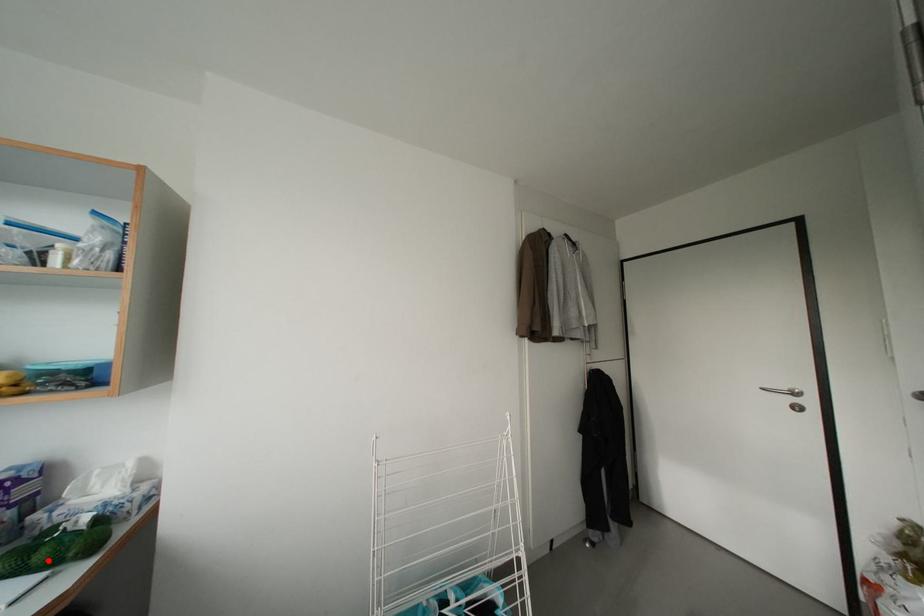
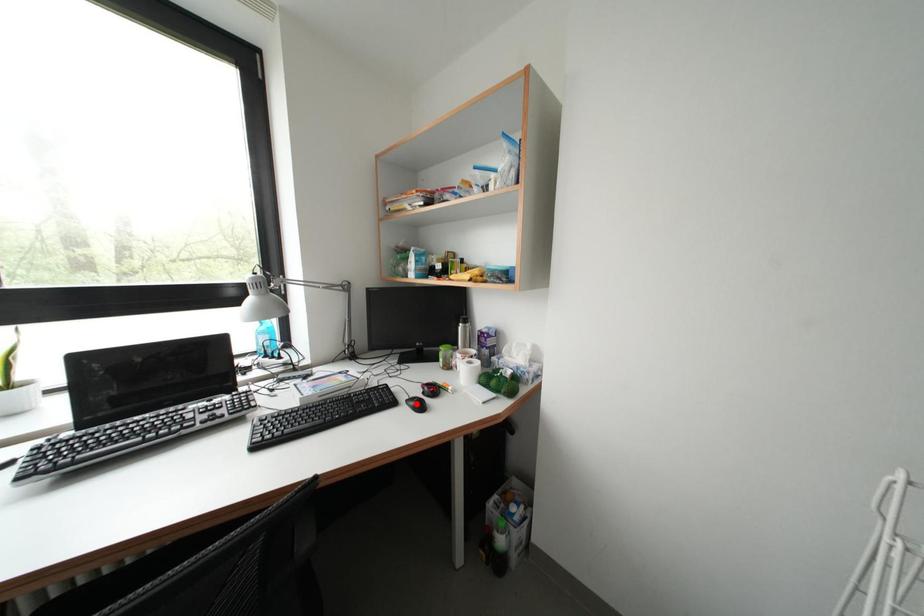
I am providing you with two images of the same scene from different viewpoints. A red point is marked on the first image and another point is marked on the second image. Are the points marked in image1 and image2 representing the same 3D position?

No